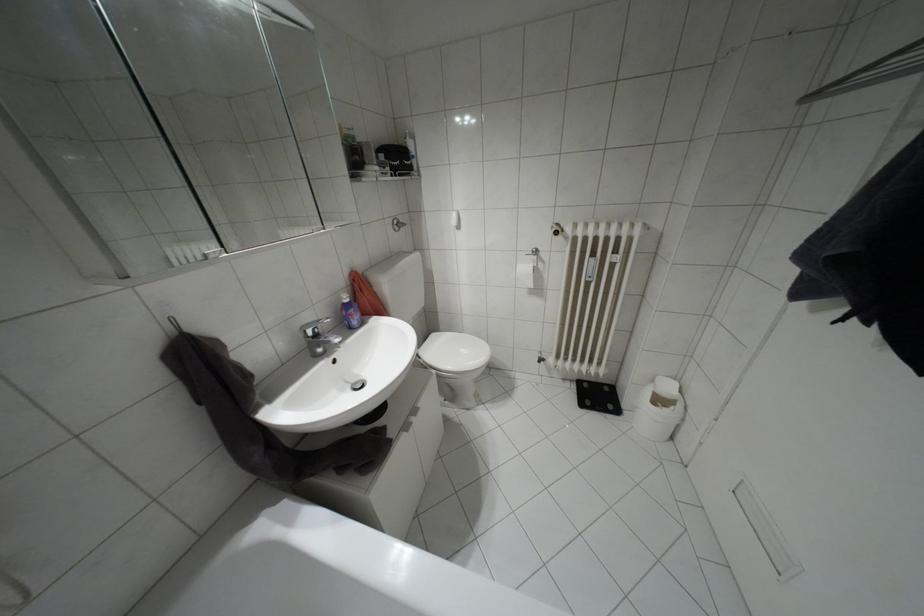
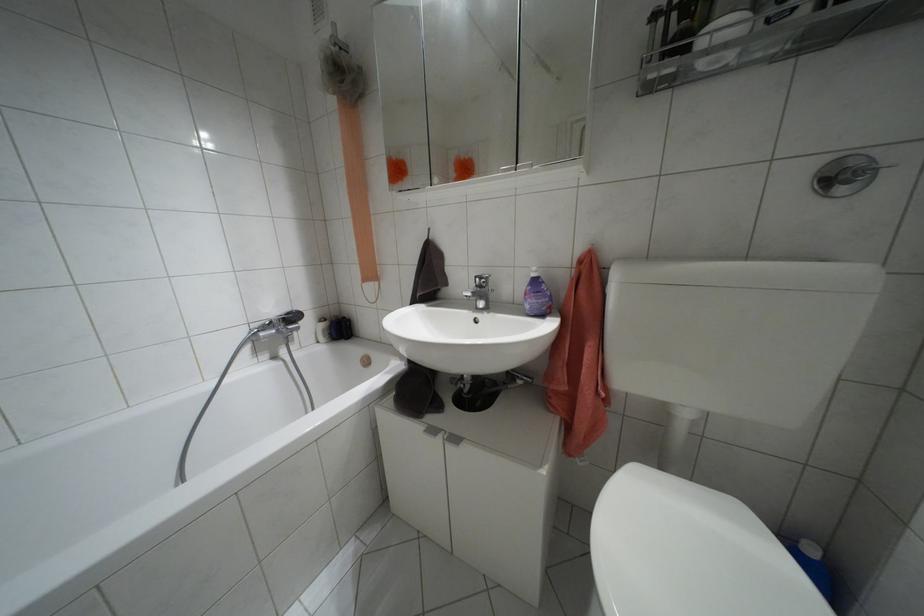
The point at (346, 300) is marked in the first image. Where is the corresponding point in the second image?

(532, 274)